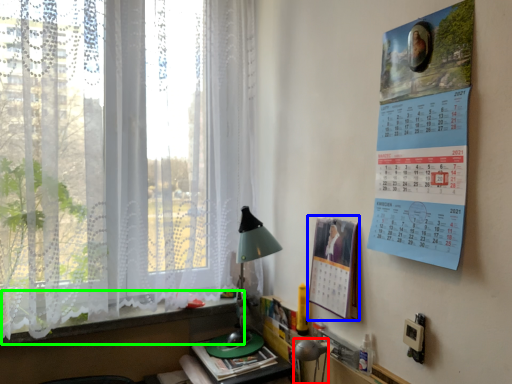
Question: Considering the real-world distances, which object is farthest from table lamp (highlighted by a red box)? poster page (highlighted by a blue box) or window sill (highlighted by a green box)?

Choices:
 (A) poster page
 (B) window sill

Answer: (B)